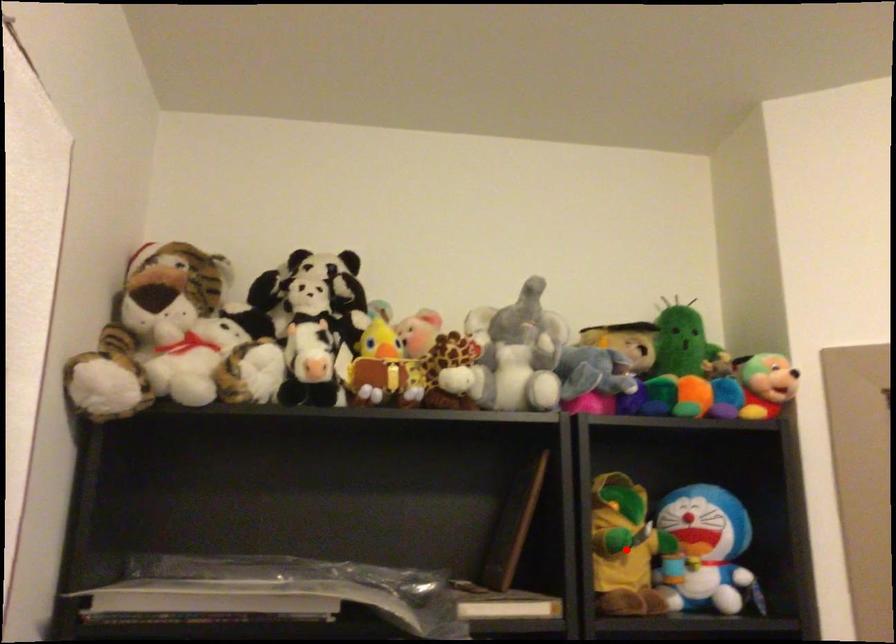
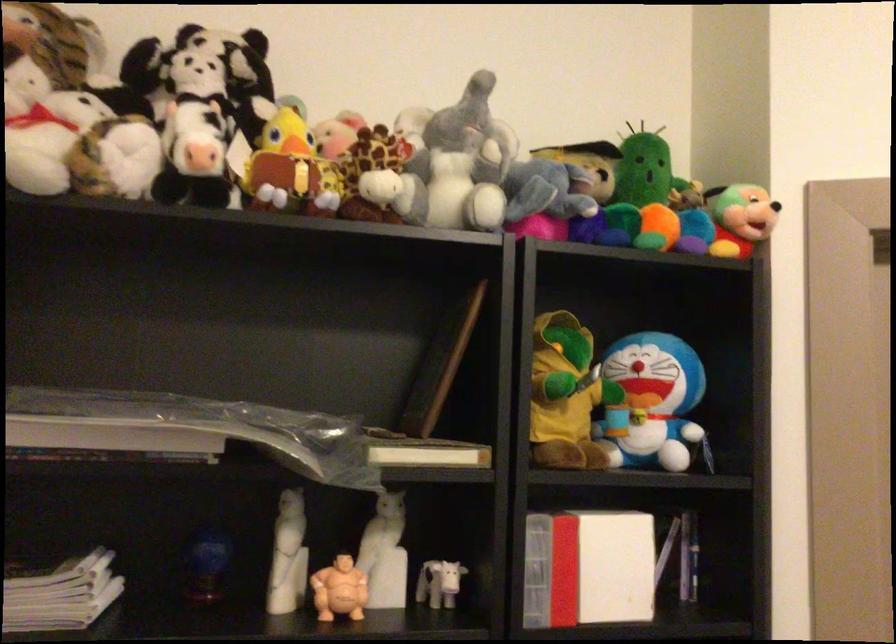
Question: I am providing you with two images of the same scene from different viewpoints. Image1 has a red point marked. In image2, the corresponding 3D location appears at what relative position? Reply with the corresponding letter.

Choices:
 (A) Closer
 (B) Farther

Answer: (A)